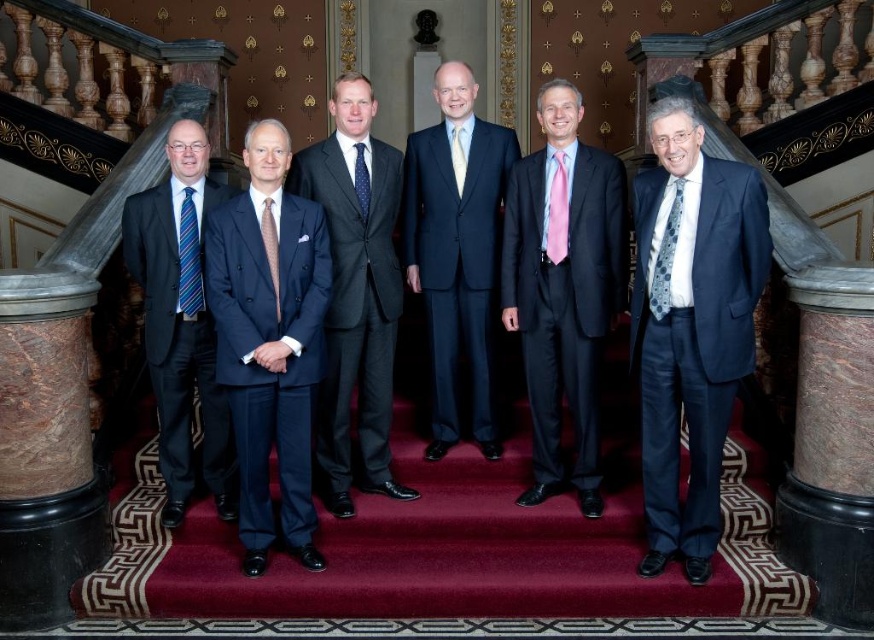
Question: Does matte blue tie at center appear under white silk tie at center?

Choices:
 (A) yes
 (B) no

Answer: (A)

Question: Estimate the real-world distances between objects in this image. Which object is closer to the matte blue suit at center?

Choices:
 (A) matte black suit at left
 (B) matte blue tie at center
 (C) blue dotted tie at center
 (D) white silk tie at center

Answer: (D)

Question: Can you confirm if matte blue suit at center is positioned below blue dotted tie at center?

Choices:
 (A) no
 (B) yes

Answer: (B)

Question: Estimate the real-world distances between objects in this image. Which object is closer to the blue dotted tie at center?

Choices:
 (A) matte blue suit at center
 (B) matte black suit at left
 (C) blue striped tie at left

Answer: (C)

Question: Can you confirm if blue striped tie at left is bigger than matte blue tie at center?

Choices:
 (A) yes
 (B) no

Answer: (A)

Question: Which point is closer to the camera?

Choices:
 (A) (342, 285)
 (B) (666, 308)

Answer: (B)